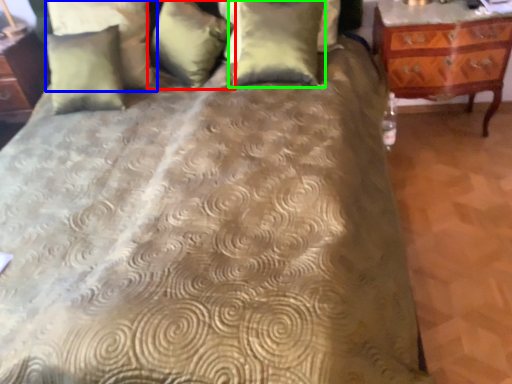
Question: Which object is positioned closest to pillow (highlighted by a red box)? Select from pillow (highlighted by a blue box) and pillow (highlighted by a green box).

Choices:
 (A) pillow
 (B) pillow

Answer: (A)